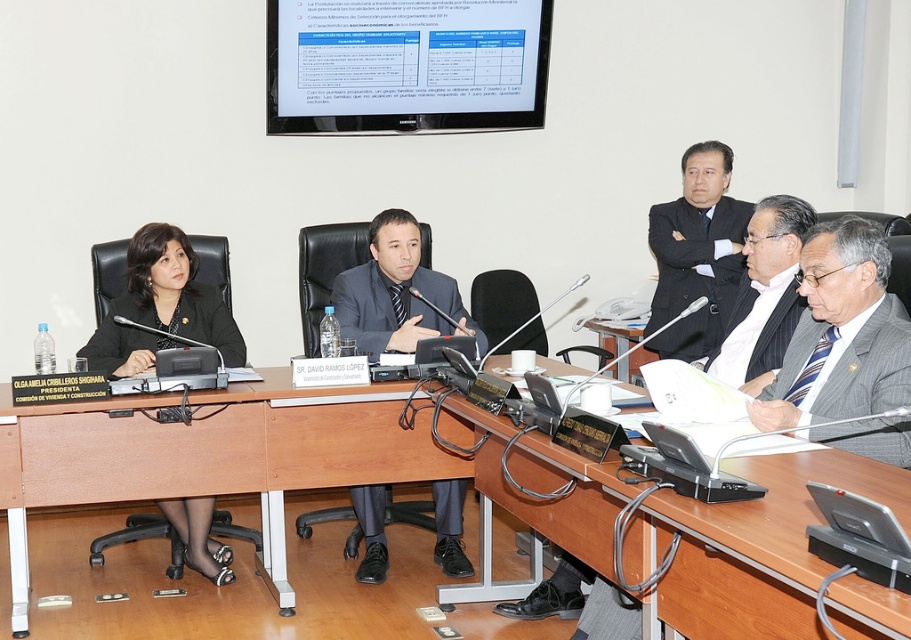
You are a photographer standing behind the camera and want to take a photo of the matte black suit at left. Can you get a clear shot without moving the camera? The camera has a maximum zoom of 5 meters.

The distance between the matte black suit at left and the camera is 3.68 meters, which is within the camera maximum zoom of 5 meters. Therefore, you can take a clear photo without moving the camera.

You are attending a virtual meeting and need to identify the order of participants based on their seating arrangement. Given the two participants wearing the matte black suit at left and the striped wool suit at right, which one is seated closer to the front of the conference room?

The matte black suit at left is seated closer to the front of the conference room because it is positioned above the striped wool suit at right in the image, indicating a more forward position.